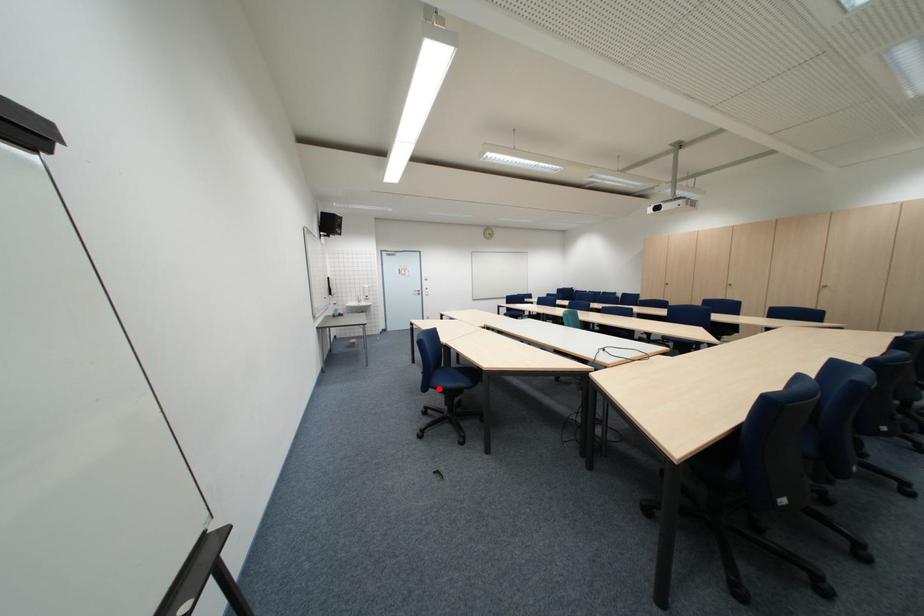
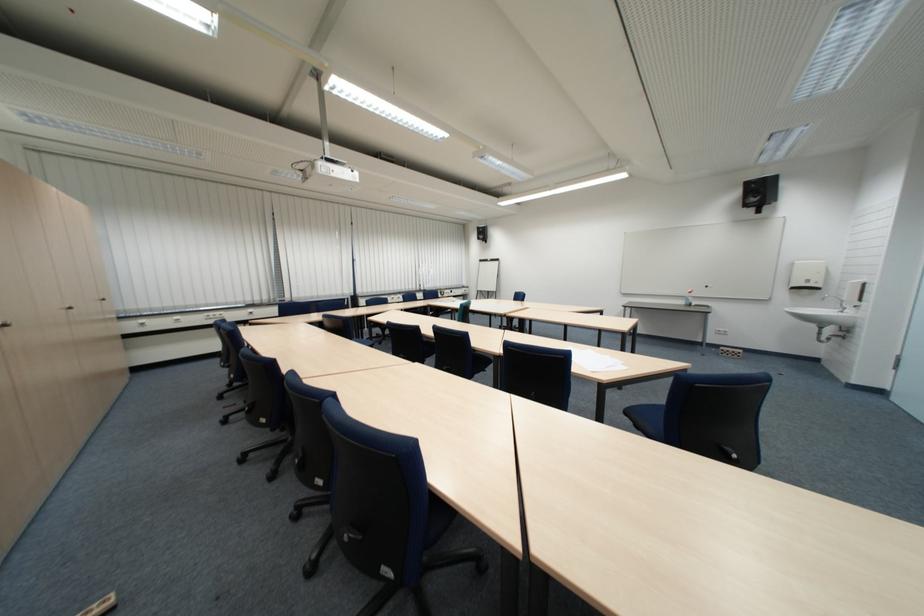
Question: I am providing you with two images of the same scene from different viewpoints. A red point is marked on the first image. Is the red point's position out of view in image 2?

Choices:
 (A) Yes
 (B) No

Answer: (A)